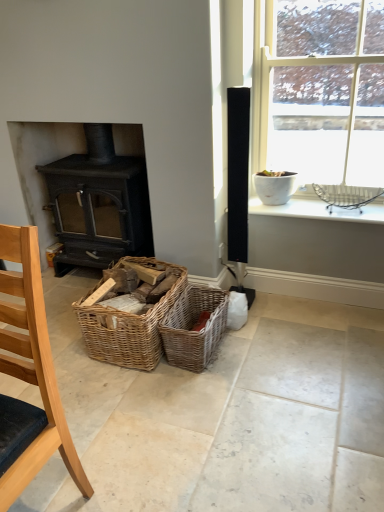
Identify the location of free space to the right of woven brown picnic basket at center, the first picnic basket from the right. The image size is (384, 512). (254, 348).